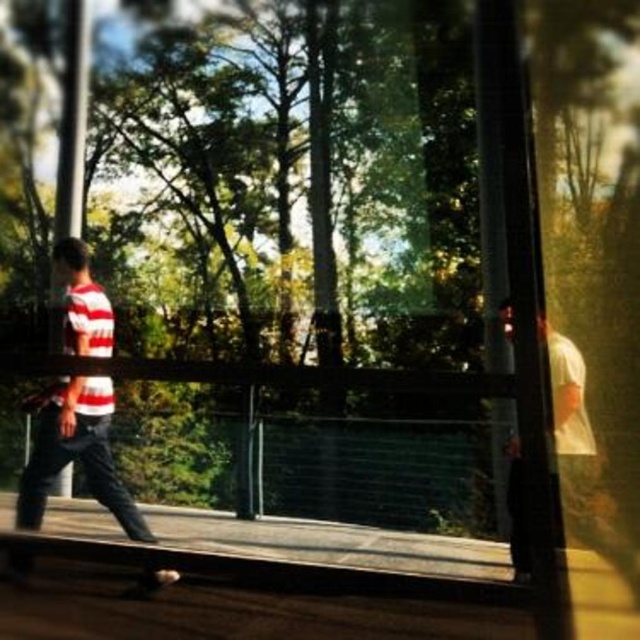
You are standing at the wooden walkway and want to move from point A to point B. Point A is located at coordinates point [100,346] and point B is at point [72,548]. Which point is closer to you?

Point [100,346] is closer to you because it is further to the viewer than point [72,548].

You are a photographer trying to capture the striped cotton shirt at left and the smooth black skateboard at lower center in the same frame. Can you tell me which object is closer to the camera based on their positions?

The striped cotton shirt at left is positioned over the smooth black skateboard at lower center, meaning it is closer to the camera.